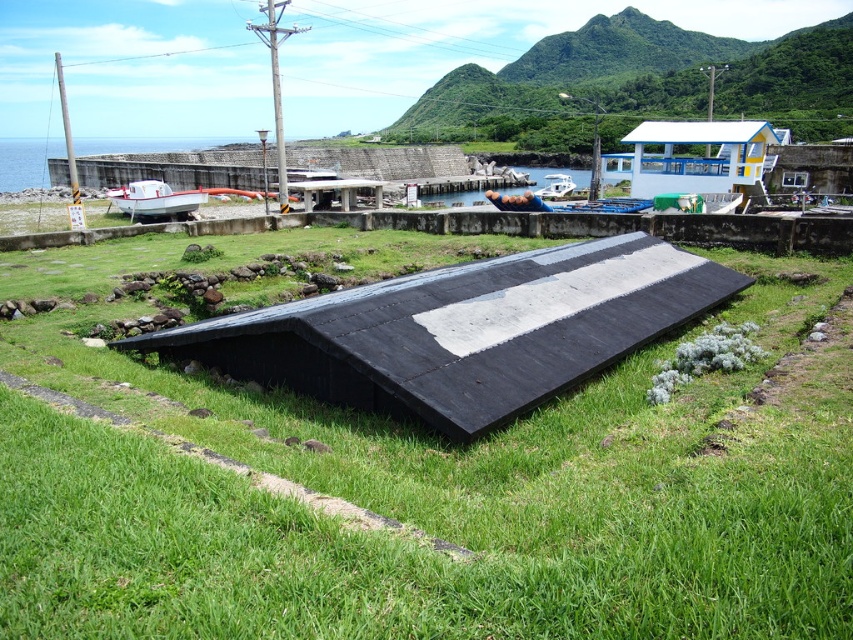
Which of these two, concrete dock at center or white glossy boat at center, stands shorter?

concrete dock at center

Can you confirm if concrete dock at center is positioned above white glossy boat at center?

Incorrect, concrete dock at center is not positioned above white glossy boat at center.

Locate an element on the screen. The height and width of the screenshot is (640, 853). concrete dock at center is located at coordinates (337, 188).

Is point (572, 376) in front of point (151, 195)?

Yes.

Looking at this image, can you confirm if black rubber dock at center is smaller than white matte boat at center?

Indeed, black rubber dock at center has a smaller size compared to white matte boat at center.

Between point (560, 282) and point (138, 195), which one is positioned in front?

Point (560, 282) is more forward.

Find the location of a particular element. black rubber dock at center is located at coordinates (463, 332).

Between point (619, 154) and point (309, 202), which one is positioned in front?

Point (309, 202) is more forward.

Who is taller, white matte hut at upper right or concrete dock at center?

white matte hut at upper right

Describe the element at coordinates (692, 157) in the screenshot. I see `white matte hut at upper right` at that location.

Find the location of a particular element. Image resolution: width=853 pixels, height=640 pixels. white matte hut at upper right is located at coordinates (692, 157).